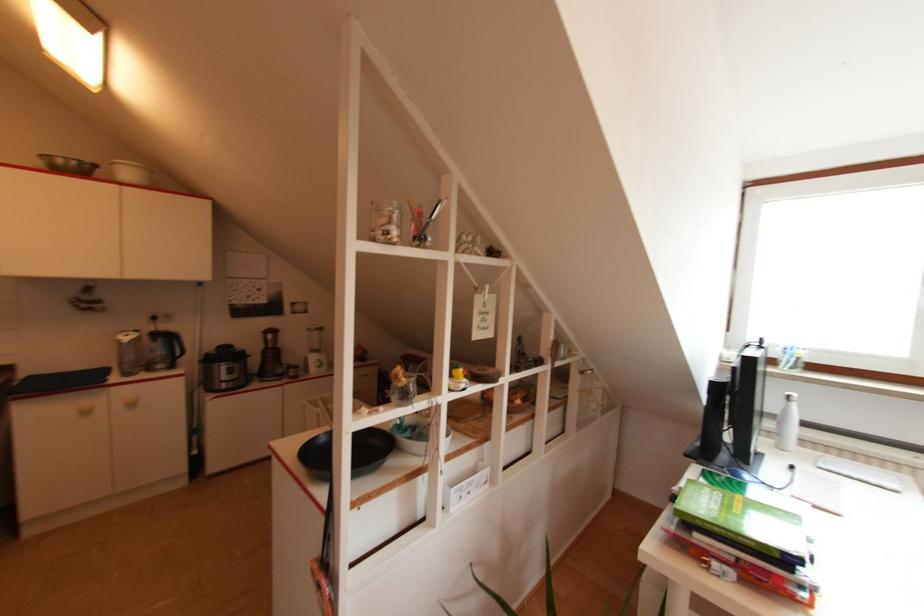
Which object does [414,434] point to?

It corresponds to the white bowl in the image.